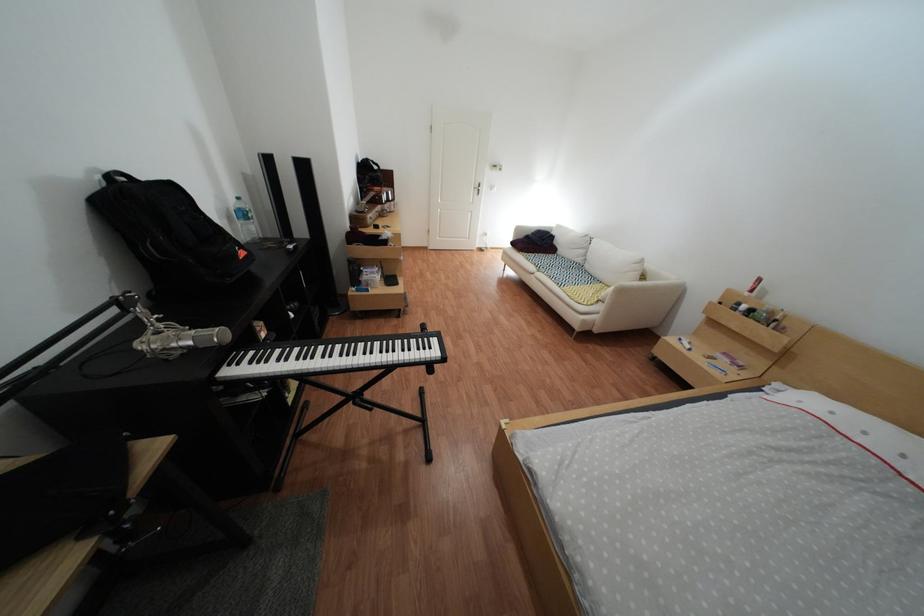
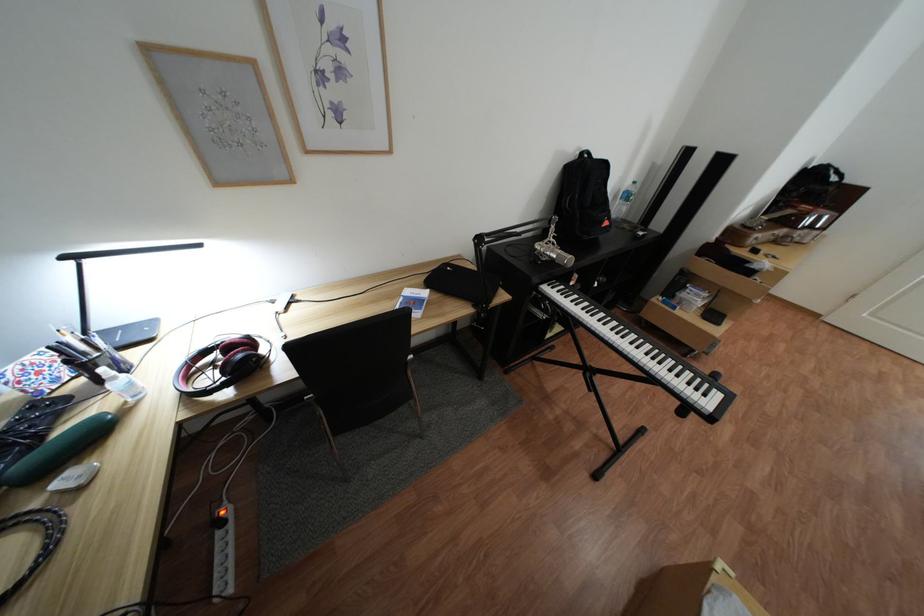
In the second image, find the point that corresponds to (x=246, y=219) in the first image.

(630, 197)